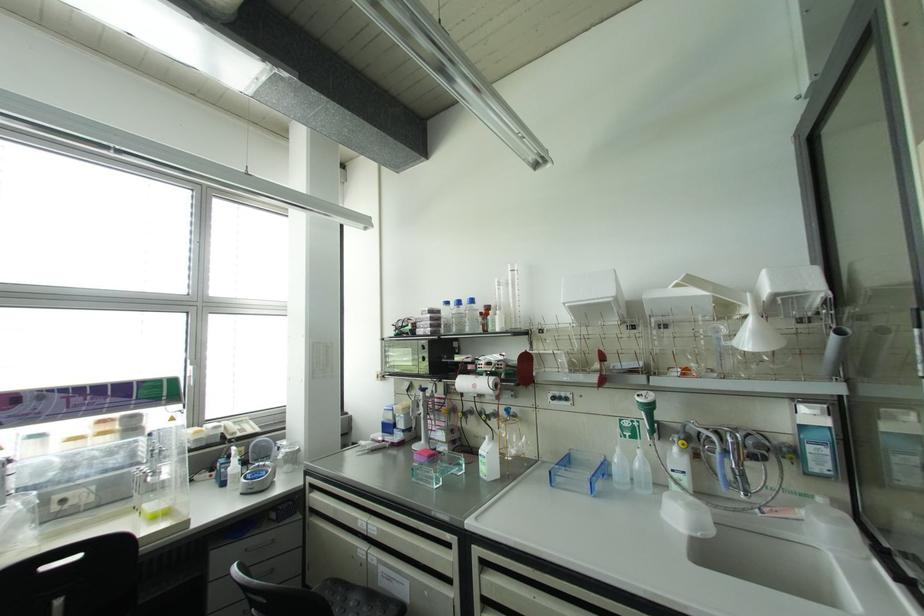
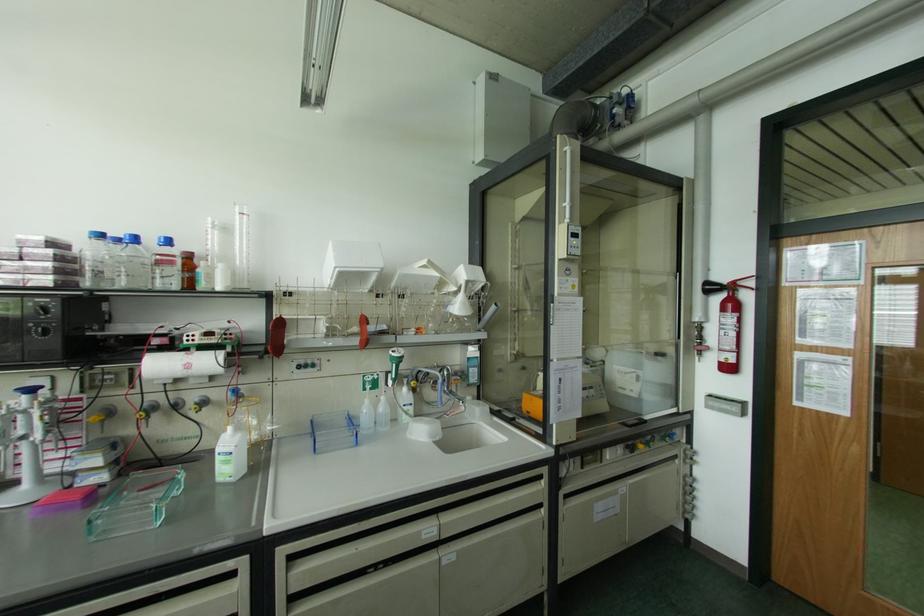
In the second image, find the point that corresponds to pixel 650 432 in the first image.

(394, 379)